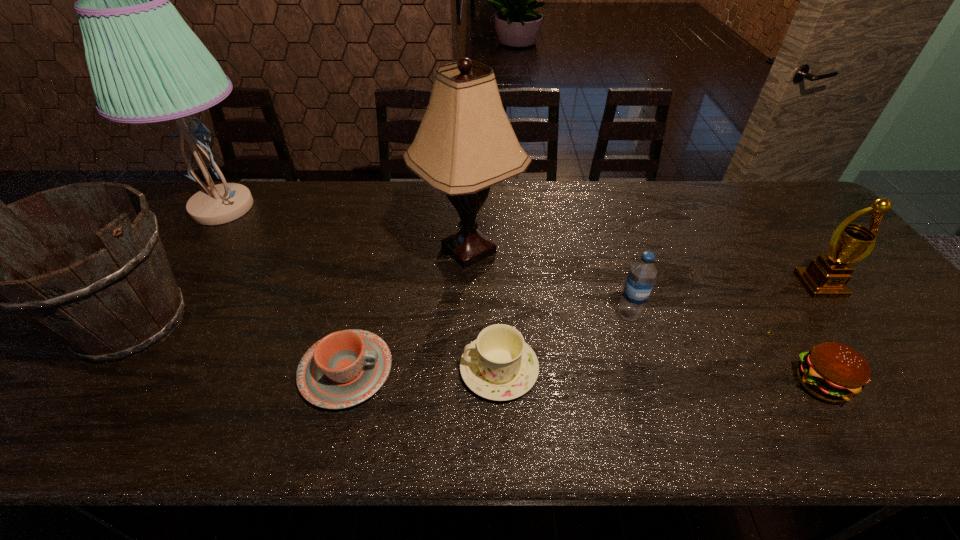
I want to click on free space that is in between the rightmost object and the hamburger, so click(x=820, y=335).

Image resolution: width=960 pixels, height=540 pixels. Identify the location of free area in between the seventh object from left to right and the fifth tallest object. (725, 349).

Where is `vacant space that is in between the shortest object and the right lamp`? Image resolution: width=960 pixels, height=540 pixels. vacant space that is in between the shortest object and the right lamp is located at coordinates (408, 310).

I want to click on vacant point located between the shortest object and the rightmost object, so click(583, 328).

Find the location of a particular element. free area in between the second object from right to left and the left lamp is located at coordinates coord(521,295).

This screenshot has width=960, height=540. I want to click on vacant space that is in between the bucket and the left chinaware, so click(240, 347).

This screenshot has height=540, width=960. Identify the location of the seventh closest object to the left lamp. (826, 277).

This screenshot has height=540, width=960. I want to click on object that is the closest to the right lamp, so click(x=345, y=368).

I want to click on blank area in the image that satisfies the following two spatial constraints: 1. on the label of the fourth shortest object; 2. on the handle side of the shortest object, so click(646, 371).